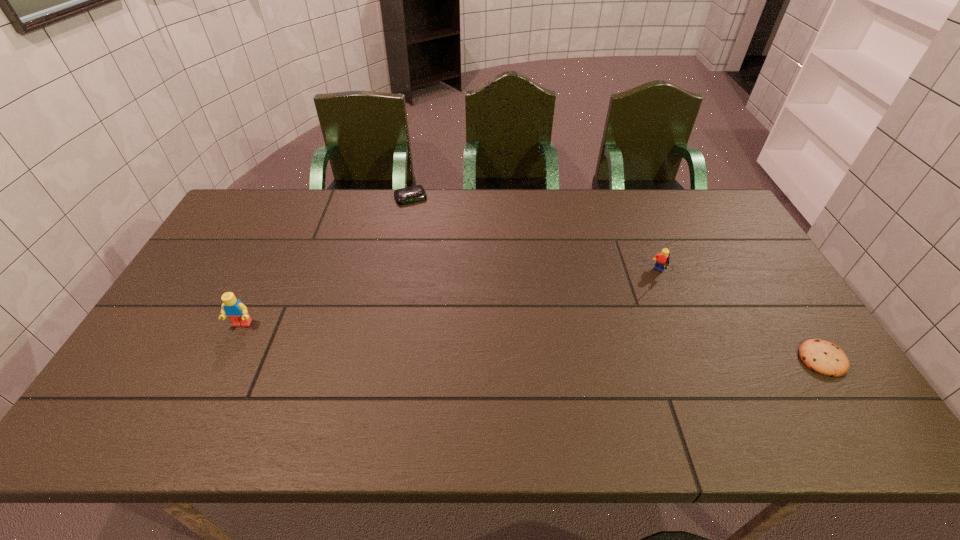
The width and height of the screenshot is (960, 540). In order to click on free space between the cookie and the alarm clock in this screenshot , I will do `click(616, 279)`.

The image size is (960, 540). In order to click on free space that is in between the third object from left to right and the left Lego in this screenshot , I will do `click(450, 299)`.

This screenshot has width=960, height=540. In order to click on free spot between the farthest object and the second object from right to left in this screenshot , I will do `click(535, 236)`.

Identify the location of free space between the nearest object and the alarm clock. The image size is (960, 540). (616, 279).

Locate an element on the screen. The width and height of the screenshot is (960, 540). vacant area that lies between the nearer Lego and the second object from right to left is located at coordinates tap(450, 299).

The image size is (960, 540). Identify the location of empty location between the farthest object and the rightmost object. (616, 279).

Identify the location of vacant area that lies between the nearest object and the leftmost object. The image size is (960, 540). (532, 342).

Select which object appears as the third closest to the nearest object. Please provide its 2D coordinates. Your answer should be formatted as a tuple, i.e. [(x, y)], where the tuple contains the x and y coordinates of a point satisfying the conditions above.

[(237, 312)]

Identify which object is located as the second nearest to the rightmost object. Please provide its 2D coordinates. Your answer should be formatted as a tuple, i.e. [(x, y)], where the tuple contains the x and y coordinates of a point satisfying the conditions above.

[(416, 193)]

You are a GUI agent. You are given a task and a screenshot of the screen. Output one action in this format:
    pyautogui.click(x=<x>, y=<y>)
    Task: Click on the vacant space that satisfies the following two spatial constraints: 1. on the front side of the alarm clock; 2. on the left side of the right Lego
    The height and width of the screenshot is (540, 960).
    Given the screenshot: What is the action you would take?
    pyautogui.click(x=396, y=273)